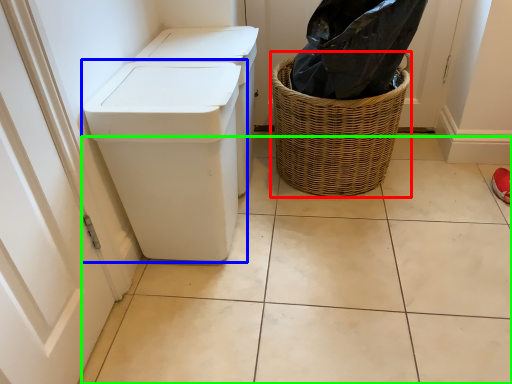
Question: Estimate the real-world distances between objects in this image. Which object is farther from basket (highlighted by a red box), waste container (highlighted by a blue box) or tile (highlighted by a green box)?

Choices:
 (A) waste container
 (B) tile

Answer: (A)